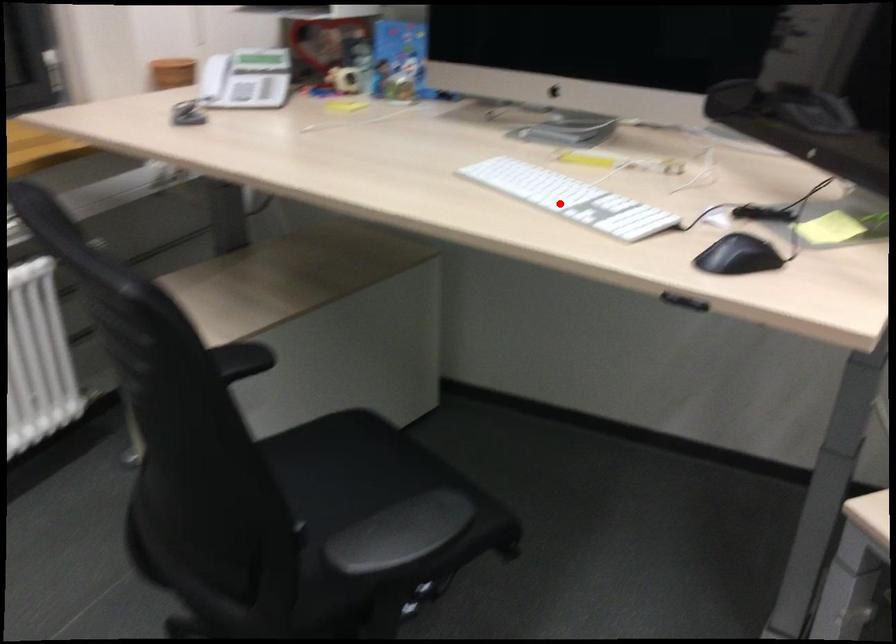
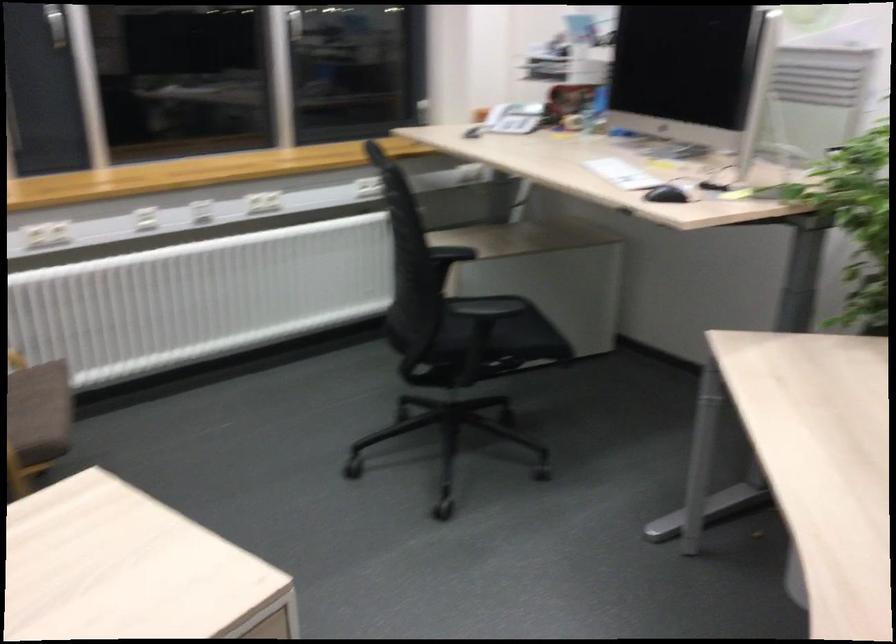
Question: I am providing you with two images of the same scene from different viewpoints. Image1 has a red point marked. In image2, the corresponding 3D location appears at what relative position? Reply with the corresponding letter.

Choices:
 (A) Closer
 (B) Farther

Answer: (B)